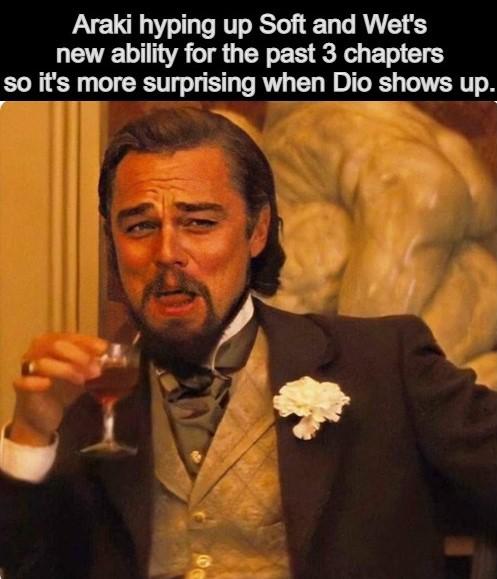
Find the location of a particular element. cup is located at coordinates pos(105,389).